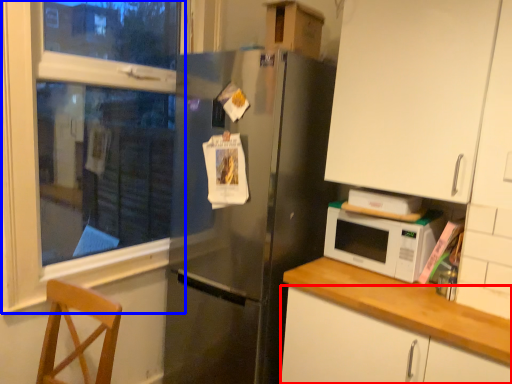
Question: Which object appears closest to the camera in this image, cabinetry (highlighted by a red box) or window frame (highlighted by a blue box)?

Choices:
 (A) cabinetry
 (B) window frame

Answer: (A)